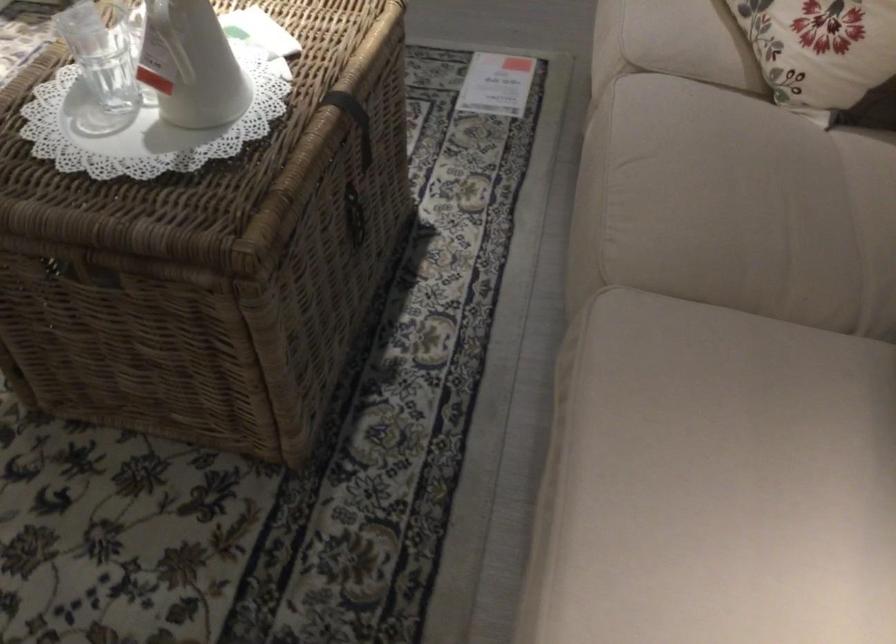
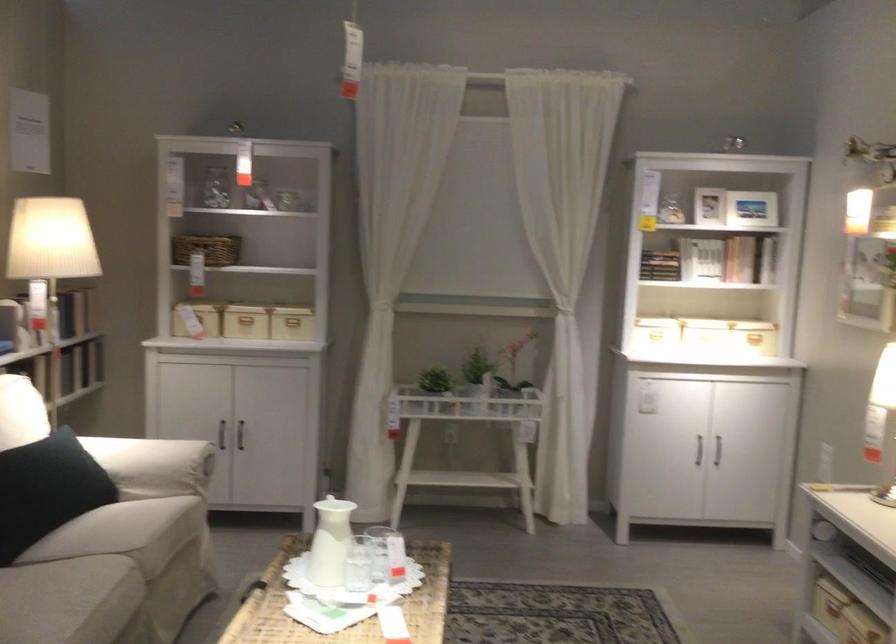
Find the pixel in the second image that matches [152,69] in the first image.

(358, 564)